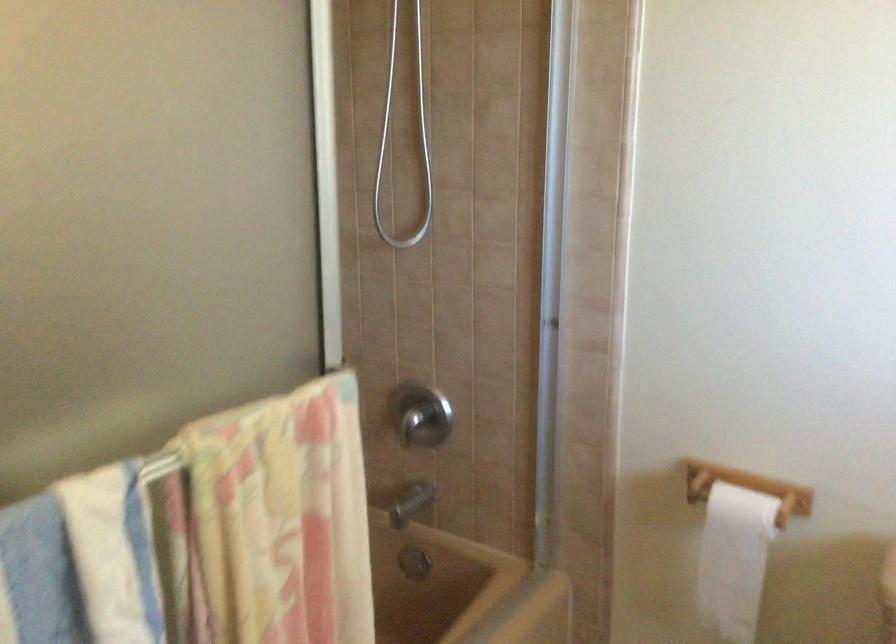
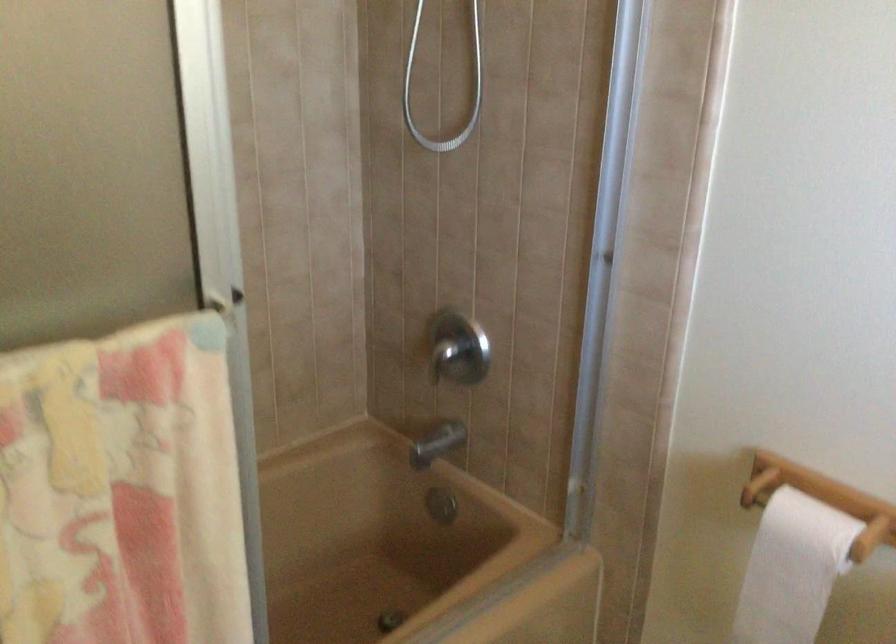
Where in the second image is the point corresponding to pixel 415 505 from the first image?

(436, 444)